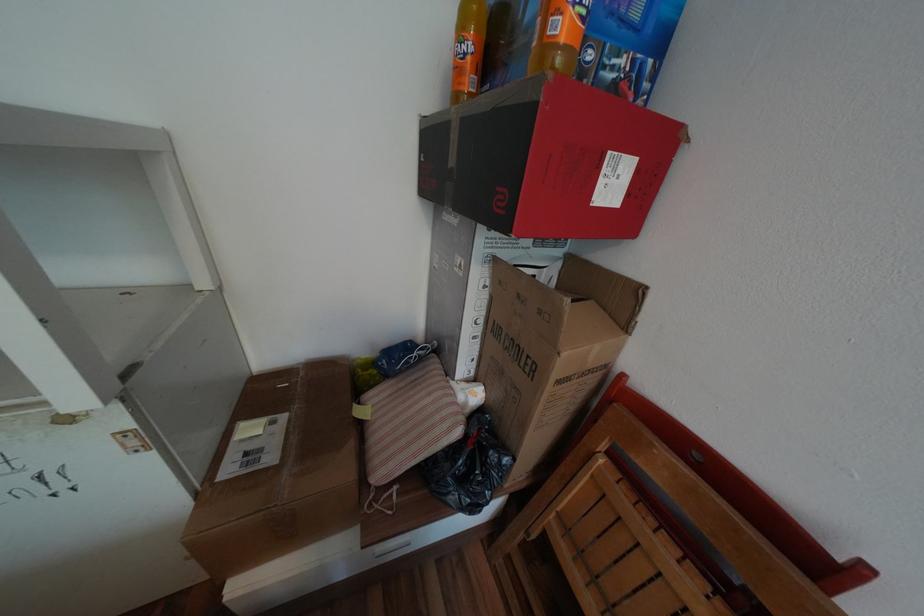
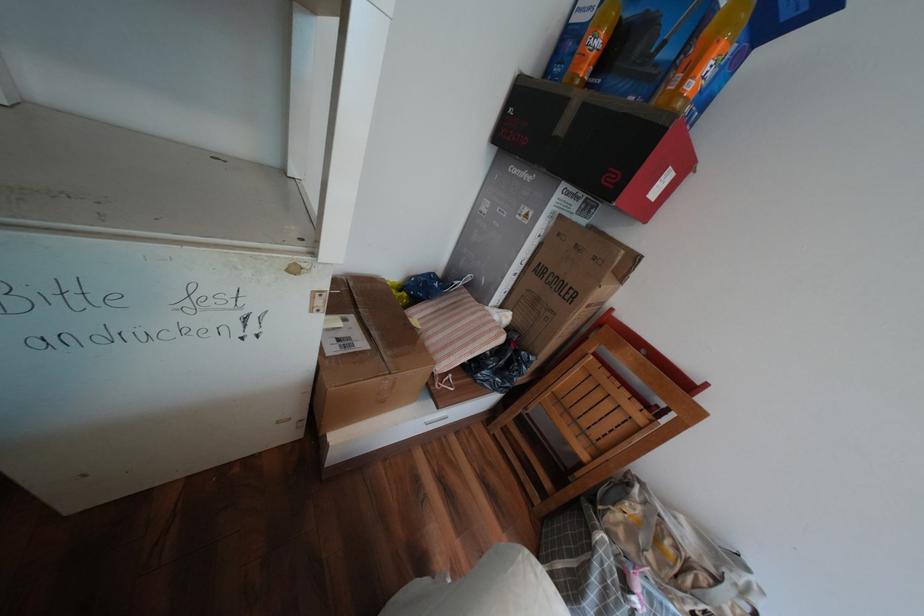
Question: The images are taken continuously from a first-person perspective. In which direction are you moving?

Choices:
 (A) Left
 (B) Right
 (C) Forward
 (D) Backward

Answer: (A)